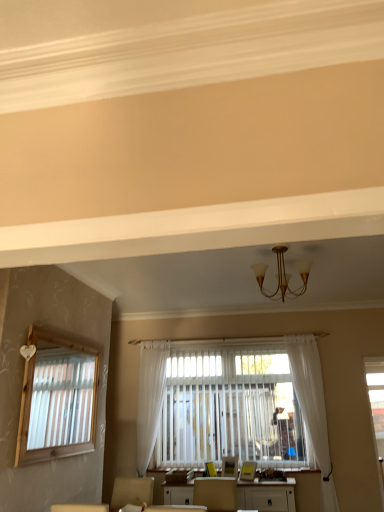
Question: Considering the positions of point click(157, 394) and point click(301, 401), is point click(157, 394) closer or farther from the camera than point click(301, 401)?

Choices:
 (A) closer
 (B) farther

Answer: (B)

Question: Considering the relative positions of white sheer curtain at center, which is the 2th curtain from right to left, and white sheer curtain at right, which ranks as the second curtain in left-to-right order, in the image provided, is white sheer curtain at center, which is the 2th curtain from right to left, to the left or to the right of white sheer curtain at right, which ranks as the second curtain in left-to-right order,?

Choices:
 (A) right
 (B) left

Answer: (B)

Question: Estimate the real-world distances between objects in this image. Which object is farther from the white sheer curtain at right, acting as the first curtain starting from the right?

Choices:
 (A) white glossy table at center
 (B) gold metallic chandelier at center
 (C) white sheer curtain at center, which is the 2th curtain from right to left

Answer: (C)

Question: Based on their relative distances, which object is farther from the gold metallic chandelier at center?

Choices:
 (A) white sheer curtain at center, marked as the 1th curtain in a left-to-right arrangement
 (B) white glossy table at center
 (C) white sheer curtain at right, acting as the first curtain starting from the right

Answer: (B)